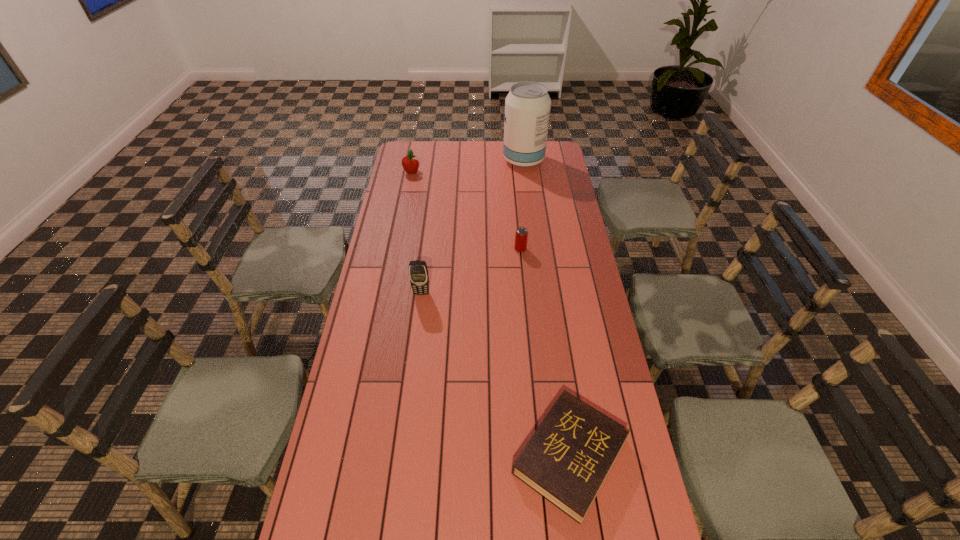
Locate an element on the screen. The width and height of the screenshot is (960, 540). object that is the third closest to the alcohol is located at coordinates (418, 273).

This screenshot has width=960, height=540. I want to click on object that stands as the closest to the beer can, so click(x=418, y=273).

Identify the location of free space that satisfies the following two spatial constraints: 1. on the front face of the nearest object; 2. on the left side of the fourth farthest object. This screenshot has width=960, height=540. (401, 456).

Image resolution: width=960 pixels, height=540 pixels. I want to click on vacant space that satisfies the following two spatial constraints: 1. on the back side of the beer can; 2. on the right side of the tallest object, so click(x=512, y=160).